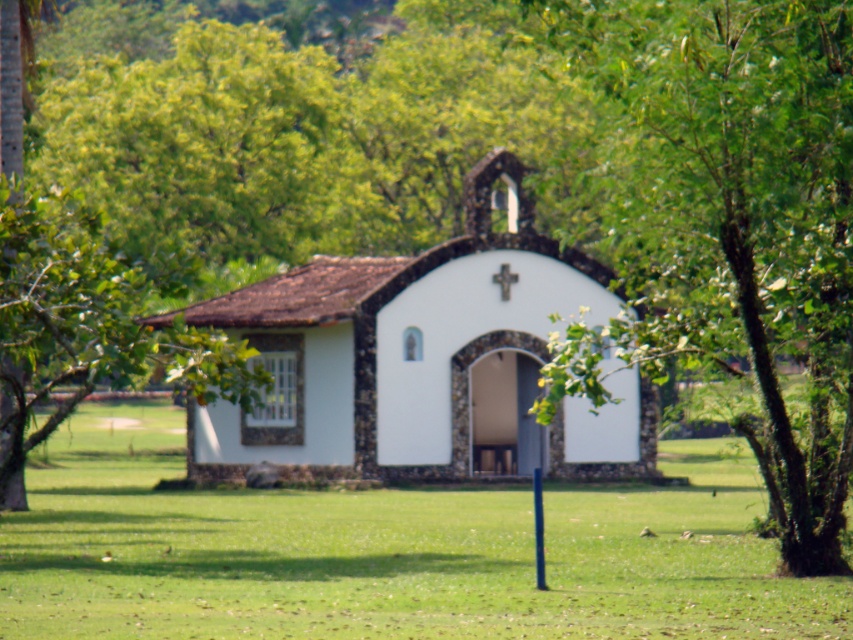
Can you confirm if green grass at center is shorter than white stucco church at center?

Yes, green grass at center is shorter than white stucco church at center.

Measure the distance between point (27, 602) and camera.

Point (27, 602) and camera are 62.26 feet apart.

This screenshot has width=853, height=640. I want to click on green grass at center, so click(x=387, y=552).